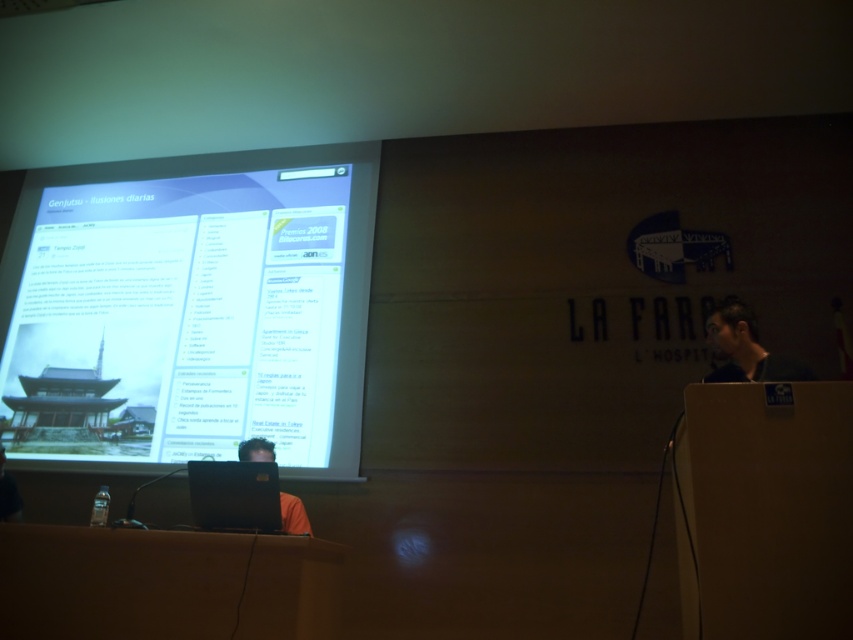
You are sitting in the conference room and want to grab the laptop that is closer to you. Which one should you choose between the black matte laptop at center and the matte black laptop at center?

You should choose the black matte laptop at center because it is closer to the viewer than the matte black laptop at center.

In the scene shown: You are setting up for a presentation and need to ensure that the white glossy projector screen at upper center is visible from the back of the room. Considering the height difference between it and the matte black laptop at right, which object should you position higher to achieve this?

The white glossy projector screen at upper center should be positioned higher than the matte black laptop at right since it is taller and needs to be visible from the back of the room.